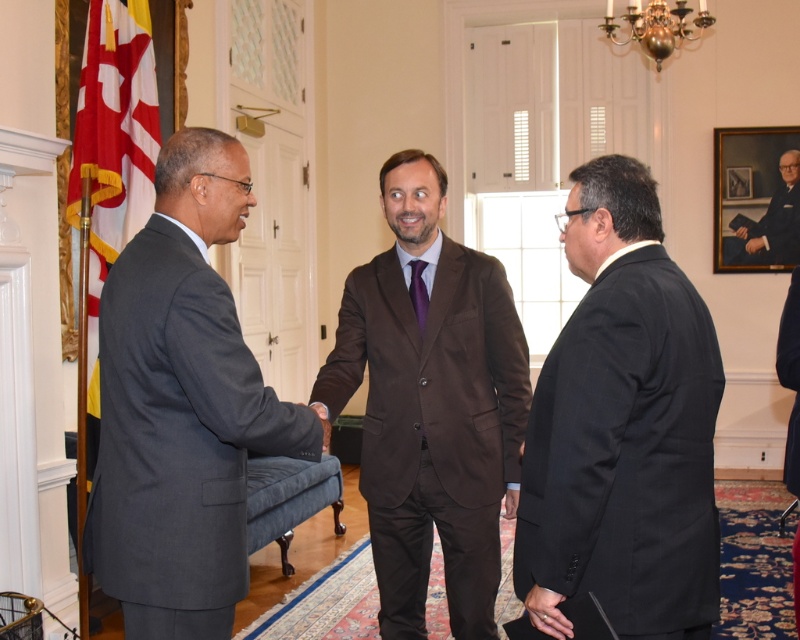
You are a photographer at this event and need to ensure all participants are clearly visible in the photo. Given the black matte suit at center and the brown satin suit at center, which suit might you need to adjust the lighting for to ensure visibility?

The black matte suit at center has a smaller size compared to the brown satin suit at center, so adjusting lighting for the smaller black matte suit at center could help ensure its visibility.